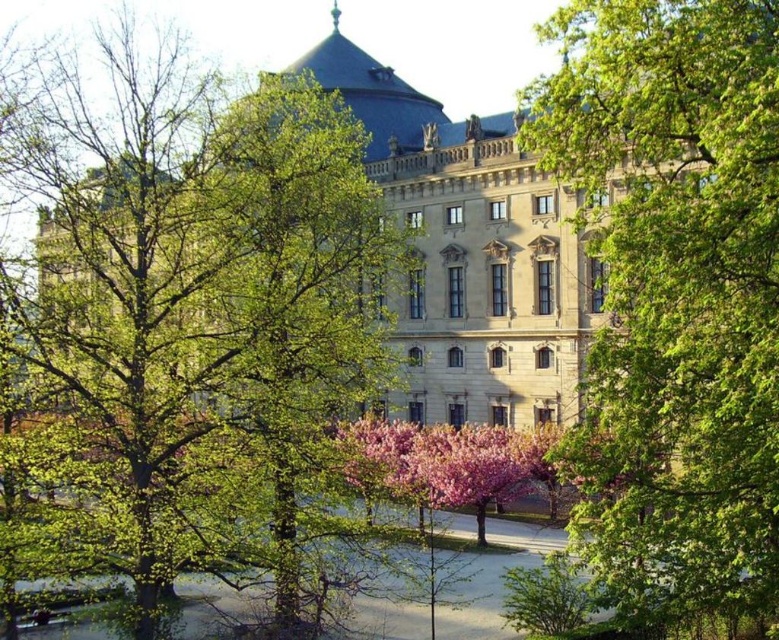
Does green leafy tree at left have a lesser width compared to stone gray palace at center?

In fact, green leafy tree at left might be wider than stone gray palace at center.

Between point (73, 253) and point (443, 417), which one is positioned behind?

The point (443, 417) is more distant.

Is point (50, 333) positioned behind point (326, 68)?

No, (50, 333) is closer to viewer.

What are the coordinates of `green leafy tree at left` in the screenshot? It's located at (189, 320).

Does point (122, 132) lie in front of point (767, 296)?

That is False.

Which is behind, point (312, 474) or point (735, 173)?

Positioned behind is point (312, 474).

Identify the location of green leafy tree at left. The image size is (779, 640). (189, 320).

Does green leafy tree at center appear over stone gray palace at center?

No.

Between green leafy tree at center and stone gray palace at center, which one is positioned higher?

stone gray palace at center

Between point (626, 273) and point (529, 211), which one is positioned behind?

The point (529, 211) is behind.

Image resolution: width=779 pixels, height=640 pixels. I want to click on green leafy tree at center, so click(x=675, y=292).